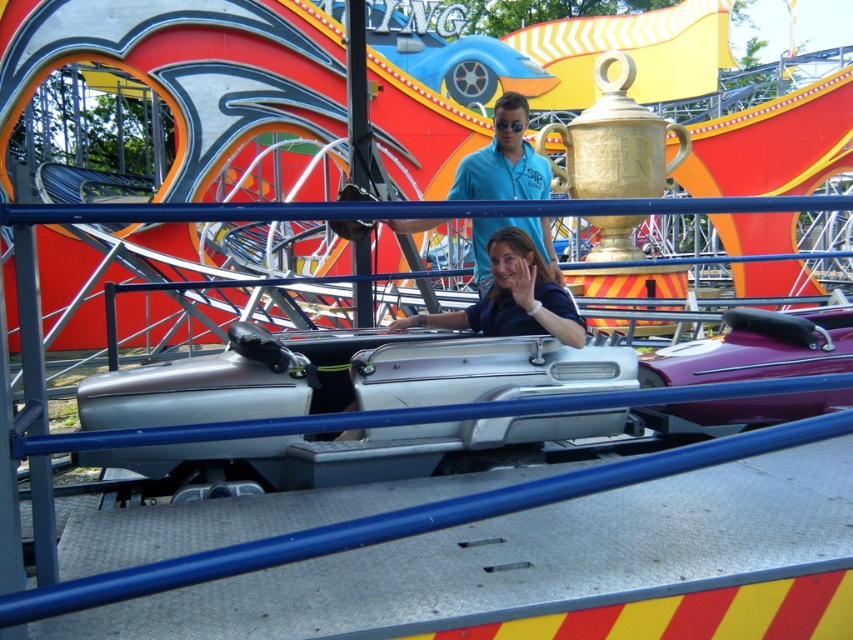
Looking at this image, is blue cotton shirt at center to the right of blue matte shirt at center from the viewer's perspective?

Correct, you'll find blue cotton shirt at center to the right of blue matte shirt at center.

Image resolution: width=853 pixels, height=640 pixels. Find the location of `blue cotton shirt at center`. blue cotton shirt at center is located at coordinates (503, 160).

Between point (468, 179) and point (477, 305), which one is positioned in front?

Point (477, 305) is more forward.

Where is `blue cotton shirt at center`? This screenshot has height=640, width=853. blue cotton shirt at center is located at coordinates (503, 160).